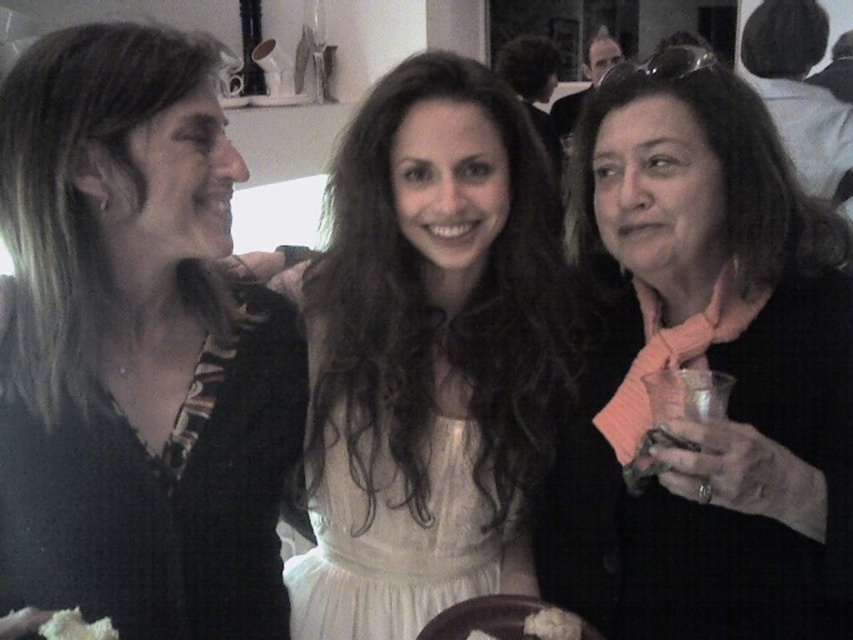
You are a guest at this gathering and want to place a small vase between the pink fabric scarf at right and the white fluffy bread at lower center. Considering their sizes, which object should the vase be closer to?

The pink fabric scarf at right is taller than the white fluffy bread at lower center. Therefore, the vase should be placed closer to the white fluffy bread at lower center to balance the height differences between the two objects.

You are at a social gathering and want to take a photo of the two points in the image. The first point is at coordinates point (x=434, y=506) and the second point is at point (x=560, y=609). To ensure both points are visible in the photo, which point should you focus on first?

You should focus on point (x=560, y=609) first because point (x=434, y=506) is behind it, so focusing on the closer point will help keep both in focus.

You are a photographer at a social gathering and want to capture a photo of the white satin dress at center and the white fluffy bread at lower center. Which object is positioned higher in the image?

The white satin dress at center is positioned higher in the image because it is much taller than the white fluffy bread at lower center.